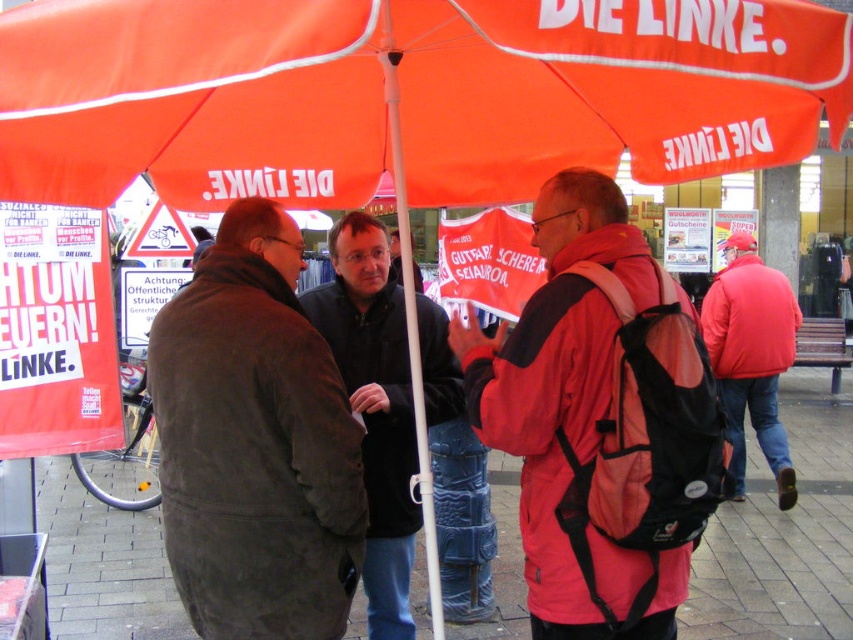
Question: Is orange fabric canopy at upper center to the right of red matte jacket at right from the viewer's perspective?

Choices:
 (A) yes
 (B) no

Answer: (B)

Question: Which object is the closest to the dark gray suede coat at center?

Choices:
 (A) matte pink jacket with backpack at center
 (B) orange fabric canopy at upper center
 (C) white plastic pole at center
 (D) dark gray jacket at center

Answer: (C)

Question: Among these objects, which one is nearest to the camera?

Choices:
 (A) orange fabric canopy at upper center
 (B) dark gray suede coat at center
 (C) red matte jacket at right

Answer: (A)

Question: Where is matte pink jacket with backpack at center located in relation to dark gray suede coat at center in the image?

Choices:
 (A) right
 (B) left

Answer: (A)

Question: From the image, what is the correct spatial relationship of red matte jacket at right in relation to white plastic pole at center?

Choices:
 (A) below
 (B) above

Answer: (A)

Question: Which point is closer to the camera?

Choices:
 (A) (770, 404)
 (B) (416, 412)

Answer: (B)